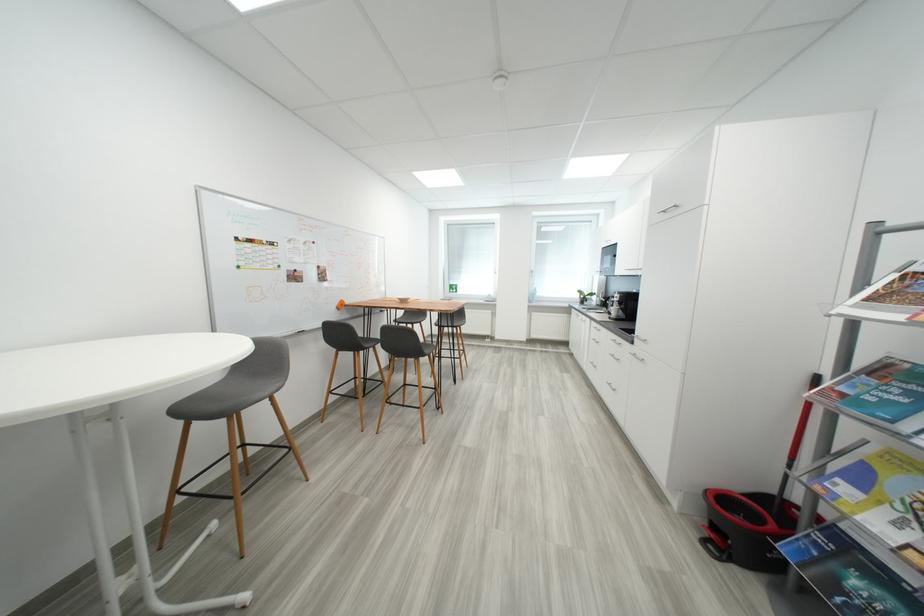
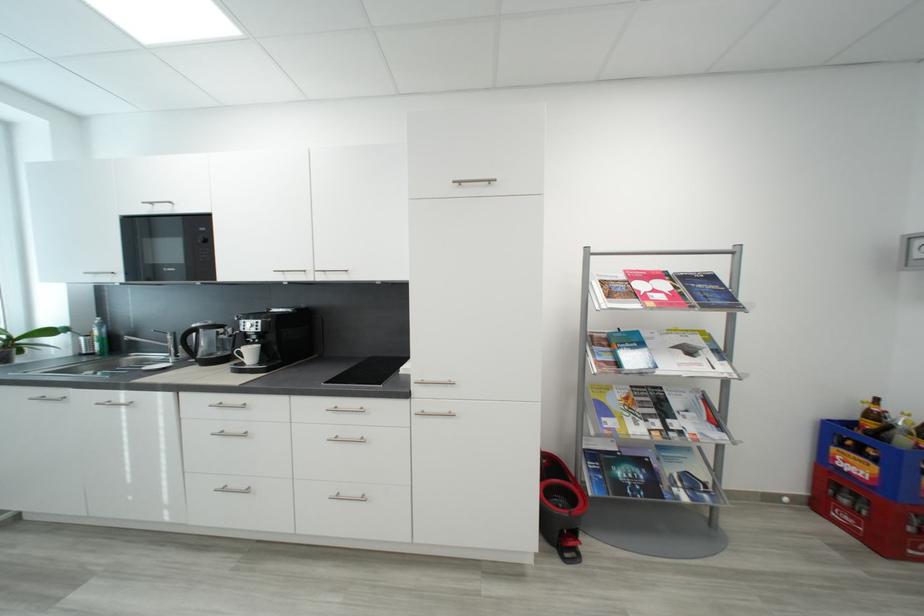
Find the pixel in the second image that matches [621,312] in the first image.

(257, 354)